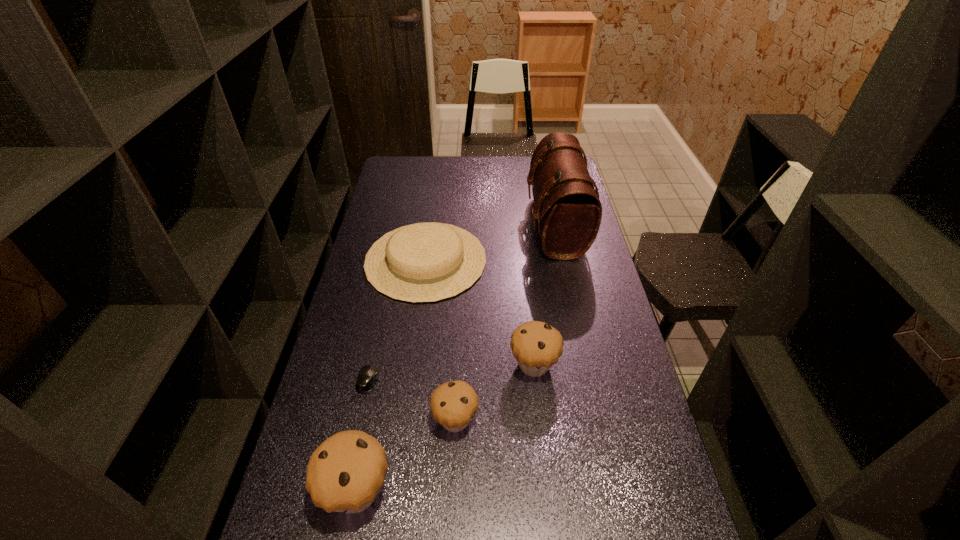
Where is `the nearest object`? This screenshot has height=540, width=960. the nearest object is located at coordinates (345, 473).

Where is `the nearest muffin`? This screenshot has height=540, width=960. the nearest muffin is located at coordinates (345, 473).

This screenshot has width=960, height=540. I want to click on the fourth tallest object, so click(453, 404).

Locate an element on the screen. the second nearest object is located at coordinates (453, 404).

Where is `the rightmost muffin`? This screenshot has height=540, width=960. the rightmost muffin is located at coordinates (536, 346).

This screenshot has width=960, height=540. I want to click on the fourth shortest object, so click(x=536, y=346).

The image size is (960, 540). Identify the location of the second shortest object. (424, 262).

Identify the location of the tallest object. The height and width of the screenshot is (540, 960). 567,206.

Identify the location of mouse. (368, 375).

At what (x,y) coordinates should I click in order to perform the action: click on blank area located on the right of the leftmost muffin. Please return your answer as a coordinate pair (x, y). Looking at the image, I should click on tap(416, 490).